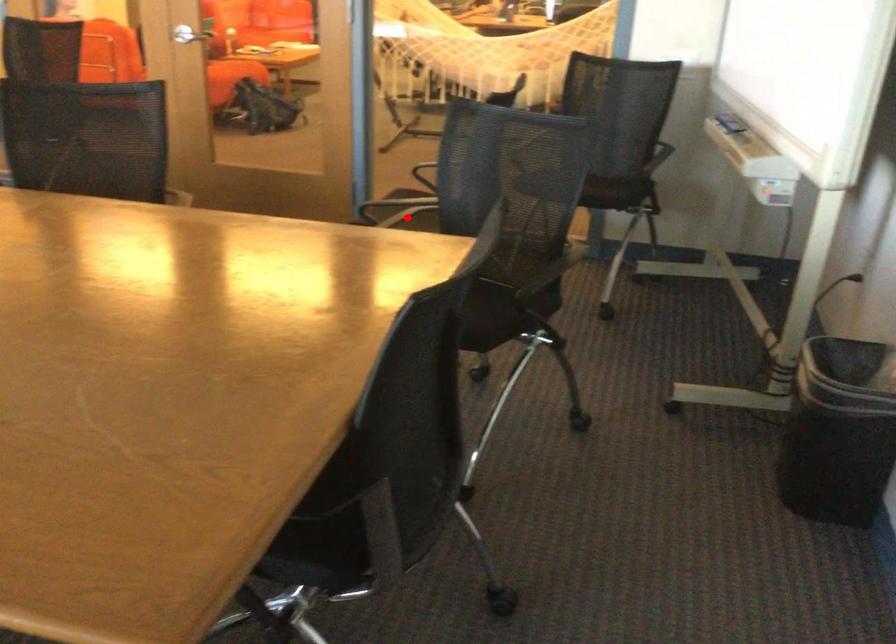
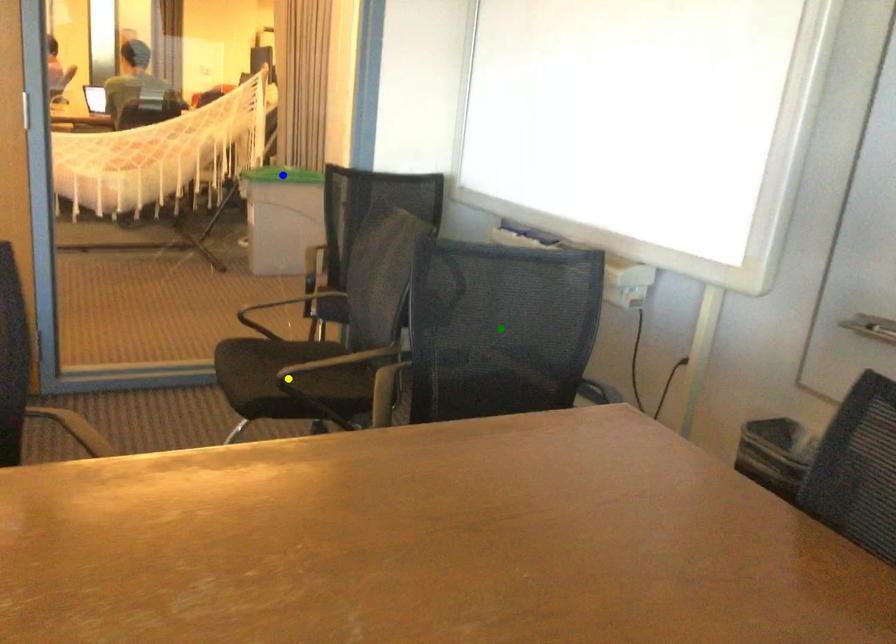
Question: I am providing you with two images of the same scene from different viewpoints. A red point is marked on the first image. You are given multiple points on the second image. Which point in image 2 represents the same 3d spot as the red point in image 1?

Choices:
 (A) green point
 (B) blue point
 (C) yellow point

Answer: (C)